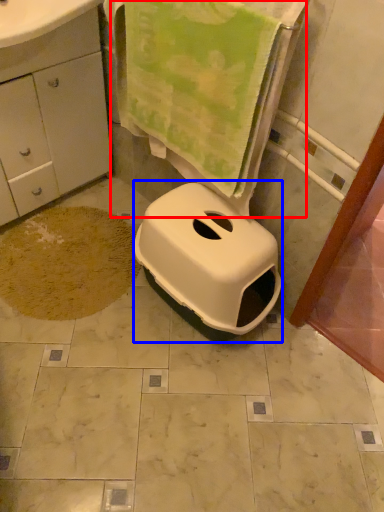
Question: Which object is further to the camera taking this photo, beach towel (highlighted by a red box) or bidet (highlighted by a blue box)?

Choices:
 (A) beach towel
 (B) bidet

Answer: (B)